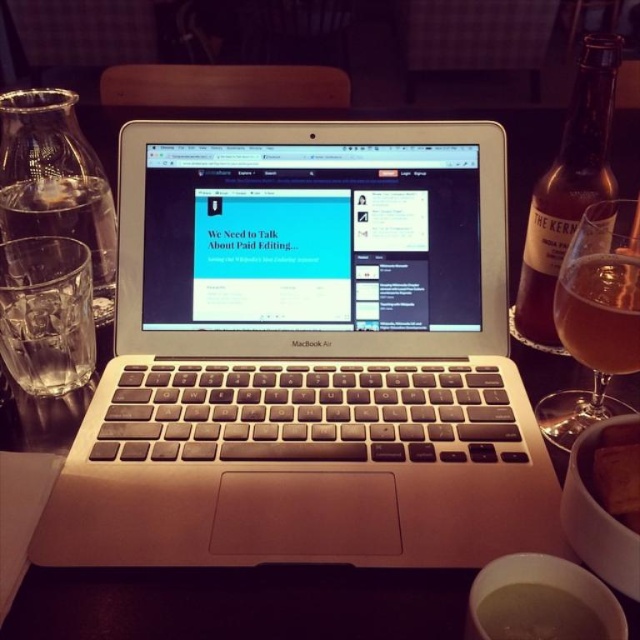
Question: Which point is closer to the camera taking this photo?

Choices:
 (A) (198, 554)
 (B) (548, 209)
 (C) (577, 326)
 (D) (634, 516)

Answer: (D)

Question: Is silver metallic laptop at center positioned behind translucent glass wine glass at right?

Choices:
 (A) no
 (B) yes

Answer: (A)

Question: Does metallic silver laptop at center have a greater width compared to brown glass bottle at right?

Choices:
 (A) yes
 (B) no

Answer: (A)

Question: Which is farther from the metallic silver laptop at center?

Choices:
 (A) silver metallic laptop at center
 (B) translucent glass wine glass at right

Answer: (B)

Question: Which point is farther to the camera?

Choices:
 (A) metallic silver laptop at center
 (B) translucent glass wine glass at right
 (C) brown glass bottle at right

Answer: (C)

Question: Can you confirm if translucent glass wine glass at right is positioned above brown glass bottle at right?

Choices:
 (A) no
 (B) yes

Answer: (A)